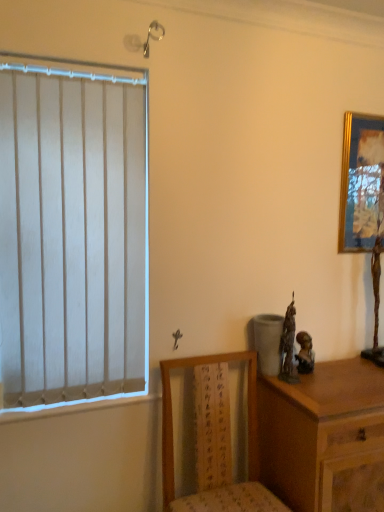
Question: Can you confirm if wooden chair at lower center is shorter than wooden chest of drawers at right?

Choices:
 (A) no
 (B) yes

Answer: (B)

Question: Is wooden chair at lower center oriented towards wooden chest of drawers at right?

Choices:
 (A) yes
 (B) no

Answer: (B)

Question: From a real-world perspective, is wooden chair at lower center physically below wooden chest of drawers at right?

Choices:
 (A) no
 (B) yes

Answer: (A)

Question: Can you confirm if wooden chair at lower center is positioned to the left of wooden chest of drawers at right?

Choices:
 (A) no
 (B) yes

Answer: (B)

Question: Is wooden chair at lower center in front of wooden chest of drawers at right?

Choices:
 (A) no
 (B) yes

Answer: (B)

Question: Considering the positions of wooden chair at lower center and gold-framed picture at upper right in the image, is wooden chair at lower center bigger or smaller than gold-framed picture at upper right?

Choices:
 (A) small
 (B) big

Answer: (B)

Question: Choose the correct answer: Is wooden chair at lower center inside gold-framed picture at upper right or outside it?

Choices:
 (A) inside
 (B) outside

Answer: (B)

Question: Is point (203, 509) positioned closer to the camera than point (344, 166)?

Choices:
 (A) farther
 (B) closer

Answer: (B)

Question: Considering their positions, is wooden chair at lower center located in front of or behind gold-framed picture at upper right?

Choices:
 (A) behind
 (B) front

Answer: (B)

Question: From the image's perspective, is gold-framed picture at upper right above or below wooden chest of drawers at right?

Choices:
 (A) below
 (B) above

Answer: (B)

Question: In terms of height, does gold-framed picture at upper right look taller or shorter compared to wooden chest of drawers at right?

Choices:
 (A) tall
 (B) short

Answer: (B)

Question: Would you say gold-framed picture at upper right is inside or outside wooden chest of drawers at right?

Choices:
 (A) inside
 (B) outside

Answer: (B)

Question: Does point (337, 250) appear closer or farther from the camera than point (382, 424)?

Choices:
 (A) farther
 (B) closer

Answer: (A)

Question: Is matte bronze statue at right taller or shorter than wooden chest of drawers at right?

Choices:
 (A) short
 (B) tall

Answer: (A)

Question: From a real-world perspective, is matte bronze statue at right physically located above or below wooden chest of drawers at right?

Choices:
 (A) below
 (B) above

Answer: (B)